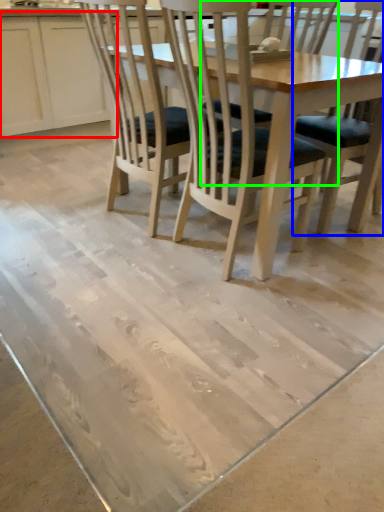
Question: Considering the real-world distances, which object is closest to cabinetry (highlighted by a red box)? chair (highlighted by a blue box) or chair (highlighted by a green box).

Choices:
 (A) chair
 (B) chair

Answer: (B)